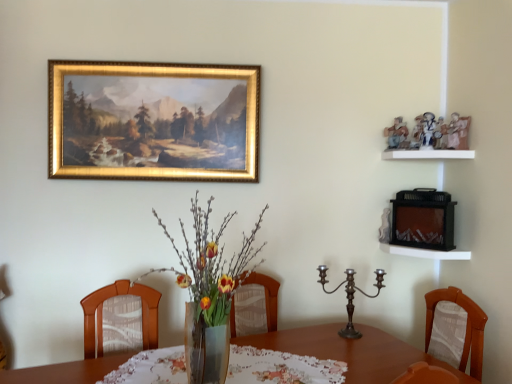
I want to click on free location above gold-framed painting at upper center (from a real-world perspective), so click(x=158, y=62).